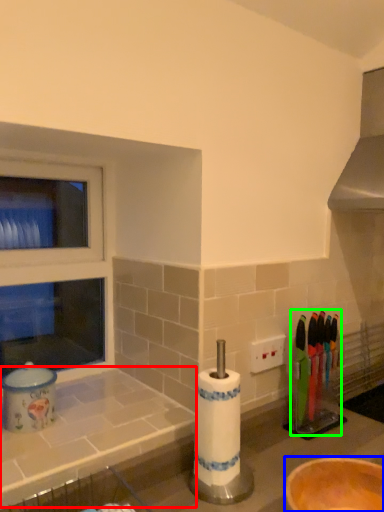
Question: Which object is positioned farthest from counter top (highlighted by a red box)? Select from bowl (highlighted by a blue box) and tableware (highlighted by a green box).

Choices:
 (A) bowl
 (B) tableware

Answer: (B)